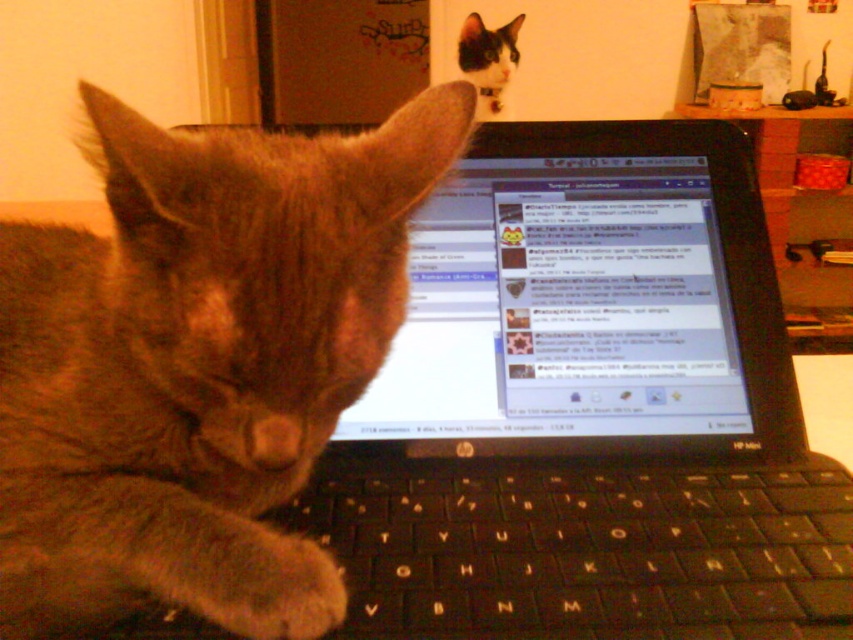
Who is positioned more to the right, black plastic keyboard at lower center or black fur cat at upper center?

From the viewer's perspective, black fur cat at upper center appears more on the right side.

Is point (556, 596) farther from camera compared to point (482, 42)?

No.

The image size is (853, 640). Find the location of `black plastic keyboard at lower center`. black plastic keyboard at lower center is located at coordinates (583, 547).

Is black plastic keyboard at lower center thinner than fuzzy fur paw at keyboard center?

Incorrect, black plastic keyboard at lower center's width is not less than fuzzy fur paw at keyboard center's.

Which is in front, point (769, 488) or point (247, 557)?

Point (247, 557) is in front.

This screenshot has height=640, width=853. Find the location of `black plastic keyboard at lower center`. black plastic keyboard at lower center is located at coordinates (583, 547).

Can you confirm if black plastic laptop at center is taller than fuzzy brown cat at center?

Indeed, black plastic laptop at center has a greater height compared to fuzzy brown cat at center.

In the scene shown: Can you confirm if black plastic laptop at center is bigger than fuzzy brown cat at center?

Correct, black plastic laptop at center is larger in size than fuzzy brown cat at center.

This screenshot has width=853, height=640. What do you see at coordinates (587, 410) in the screenshot? I see `black plastic laptop at center` at bounding box center [587, 410].

Locate an element on the screen. black plastic laptop at center is located at coordinates (587, 410).